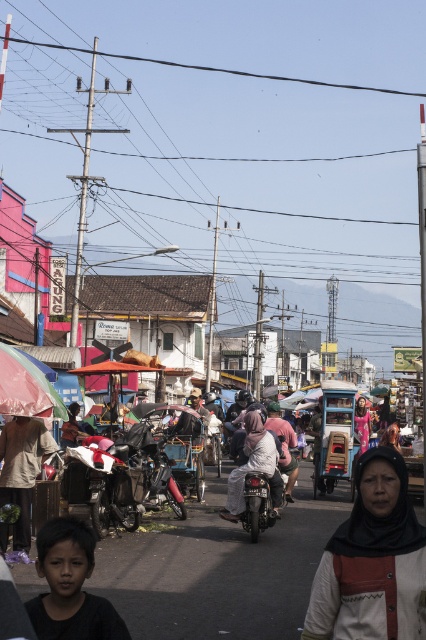
Question: Does brown fabric headscarf at lower left have a lesser width compared to rainbow fabric umbrella at left?

Choices:
 (A) no
 (B) yes

Answer: (B)

Question: Is brown fabric headscarf at lower left wider than rainbow fabric umbrella at left?

Choices:
 (A) yes
 (B) no

Answer: (B)

Question: Estimate the real-world distances between objects in this image. Which object is farther from the black matte boy at lower left?

Choices:
 (A) matte pink hijab at center
 (B) white fabric headscarf at center
 (C) rainbow fabric umbrella at left

Answer: (A)

Question: Does brown fabric headscarf at lower left have a larger size compared to rainbow fabric umbrella at left?

Choices:
 (A) yes
 (B) no

Answer: (B)

Question: Which object appears closest to the camera in this image?

Choices:
 (A) white fabric headscarf at center
 (B) matte pink hijab at center

Answer: (A)

Question: Which of the following is the farthest from the observer?

Choices:
 (A) (34, 620)
 (B) (16, 400)

Answer: (B)